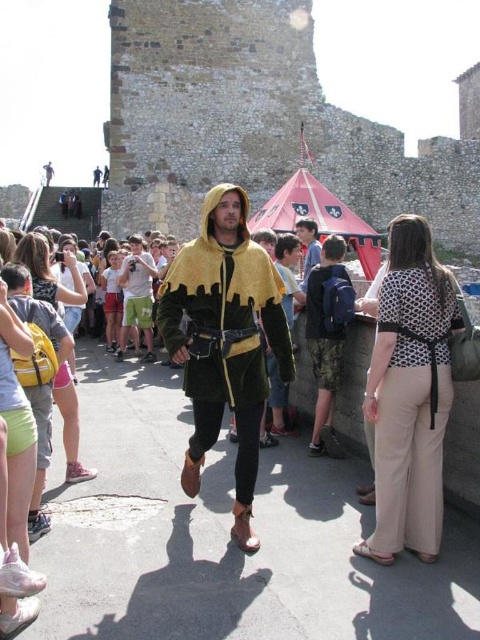
Question: Which point is closer to the camera?

Choices:
 (A) white dotted shirt at right
 (B) green leather jacket at center
 (C) green fabric shirt at center

Answer: (A)

Question: Which of the following is the farthest from the observer?

Choices:
 (A) (x=305, y=237)
 (B) (x=430, y=426)
 (C) (x=252, y=492)
 (D) (x=151, y=340)

Answer: (D)

Question: Does velvet yellow cape at center come in front of green leather jacket at center?

Choices:
 (A) no
 (B) yes

Answer: (B)

Question: Considering the relative positions of velvet yellow cape at center and green fabric shirt at center in the image provided, where is velvet yellow cape at center located with respect to green fabric shirt at center?

Choices:
 (A) left
 (B) right

Answer: (B)

Question: Estimate the real-world distances between objects in this image. Which object is closer to the green fabric shirt at center?

Choices:
 (A) velvet yellow cape at center
 (B) white dotted shirt at right

Answer: (A)

Question: From the image, what is the correct spatial relationship of velvet yellow cape at center in relation to green fabric shirt at center?

Choices:
 (A) right
 (B) left

Answer: (A)